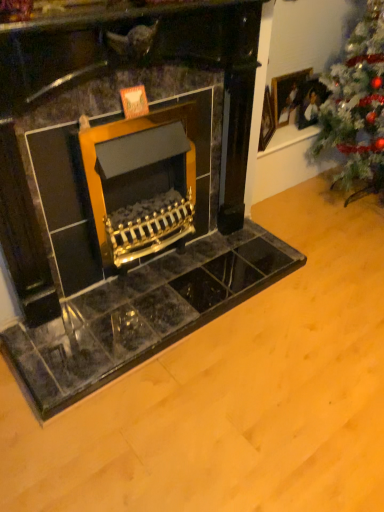
Question: From the image's perspective, is wooden picture frame at upper right located above or below green textured christmas tree at right?

Choices:
 (A) above
 (B) below

Answer: (A)

Question: Considering their positions, is wooden picture frame at upper right located in front of or behind green textured christmas tree at right?

Choices:
 (A) front
 (B) behind

Answer: (B)

Question: Which is correct: wooden picture frame at upper right is inside green textured christmas tree at right, or outside of it?

Choices:
 (A) inside
 (B) outside

Answer: (B)

Question: From the image's perspective, relative to wooden picture frame at upper right, is green textured christmas tree at right above or below?

Choices:
 (A) above
 (B) below

Answer: (B)

Question: Is green textured christmas tree at right in front of or behind wooden picture frame at upper right in the image?

Choices:
 (A) behind
 (B) front

Answer: (B)

Question: In terms of size, does green textured christmas tree at right appear bigger or smaller than wooden picture frame at upper right?

Choices:
 (A) small
 (B) big

Answer: (B)

Question: Is point (350, 129) positioned closer to the camera than point (273, 100)?

Choices:
 (A) closer
 (B) farther

Answer: (B)